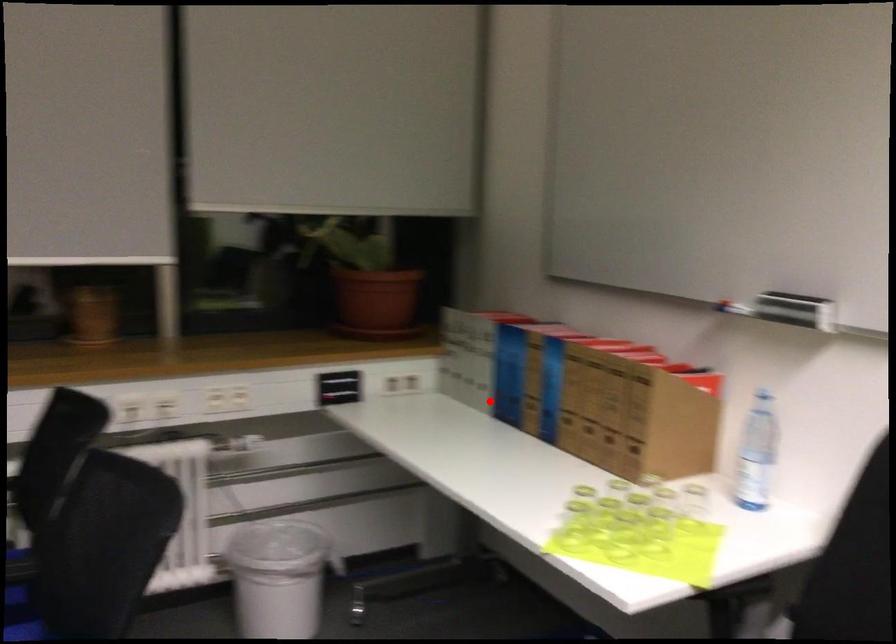
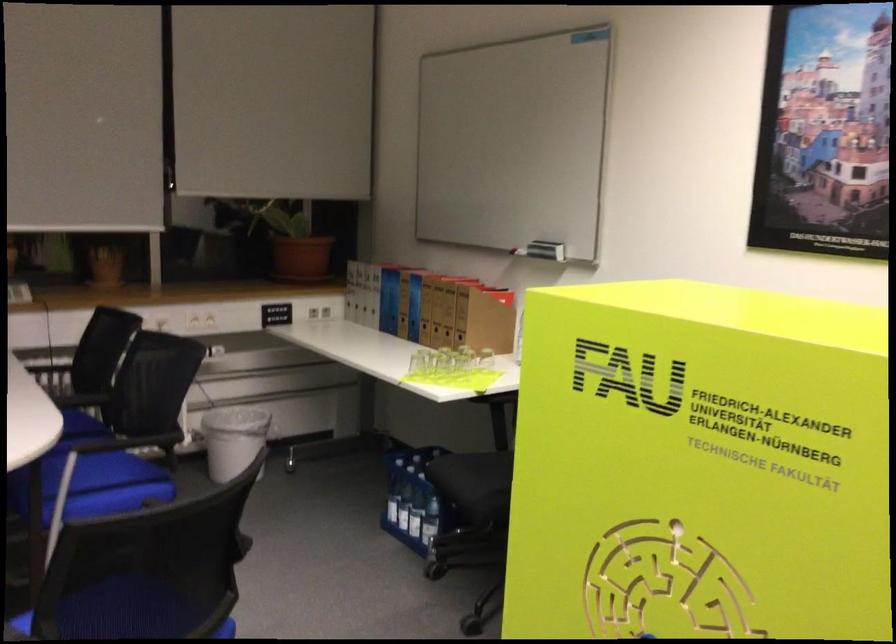
Question: I am providing you with two images of the same scene from different viewpoints. A red point is shown in image1. For the corresponding object point in image2, is it positioned nearer or farther from the camera?

Choices:
 (A) Nearer
 (B) Farther

Answer: (B)